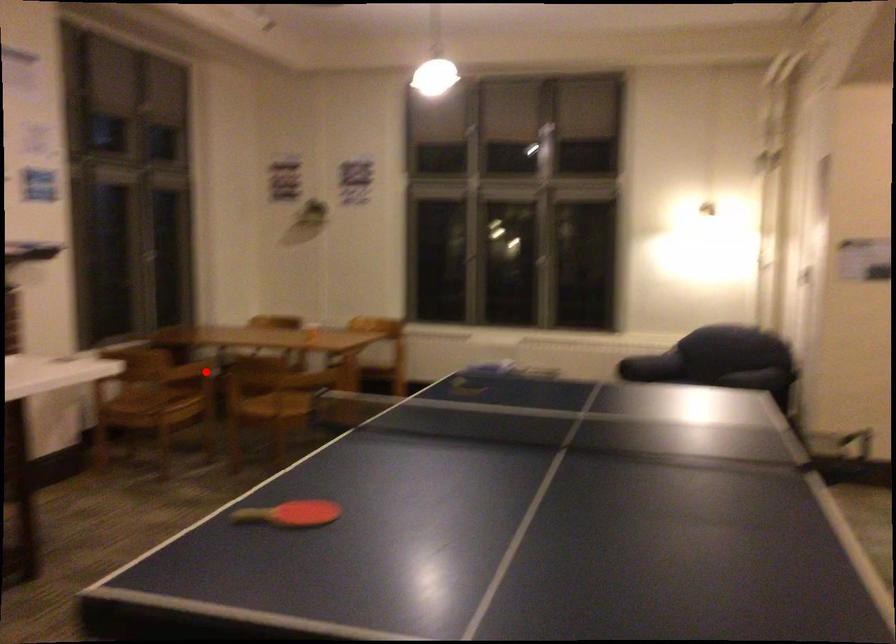
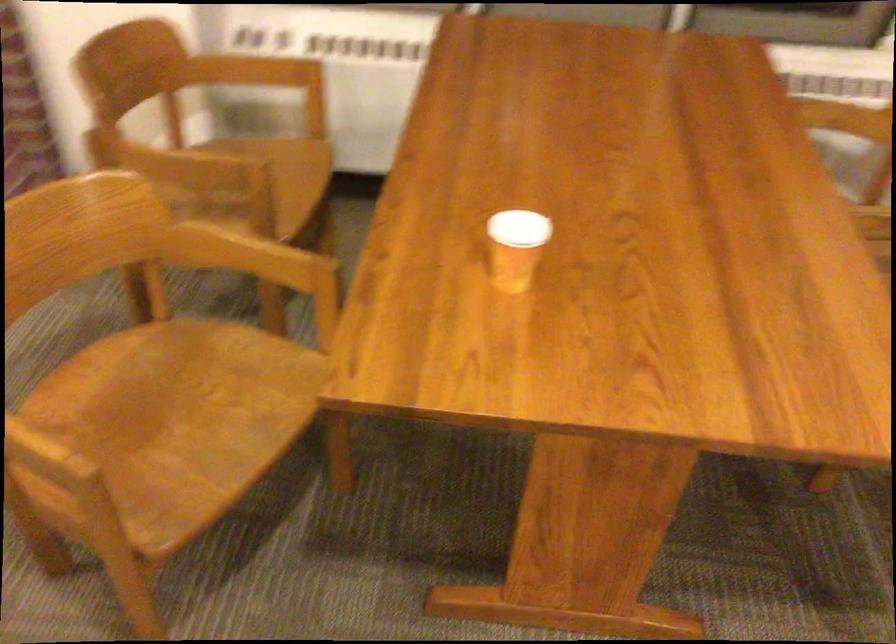
Find the pixel in the second image that matches the highlighted location in the first image.

(252, 182)